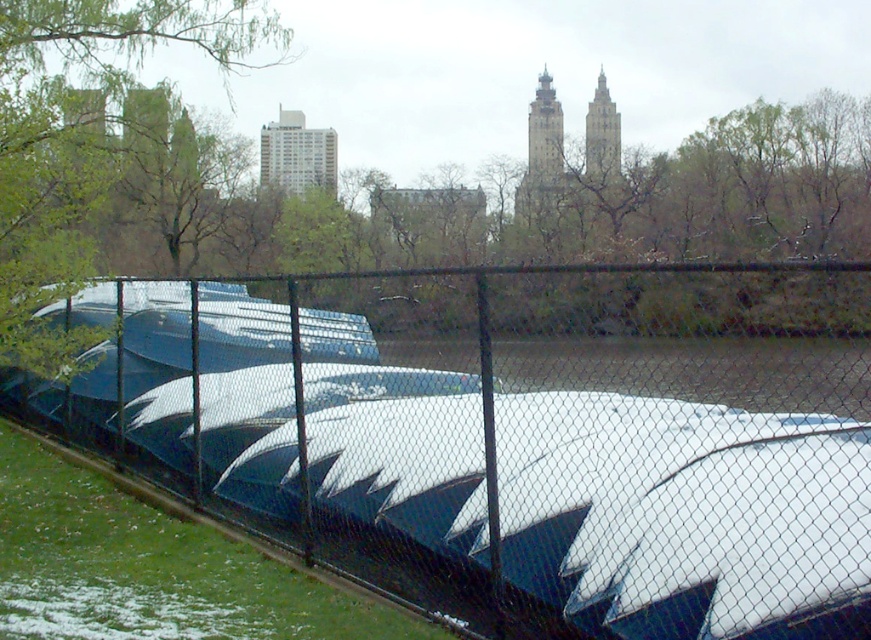
Which is behind, point (602, 468) or point (44, 93)?

Point (44, 93)

Who is more forward, (x=454, y=566) or (x=44, y=32)?

Positioned in front is point (x=454, y=566).

Which is behind, point (525, 621) or point (3, 35)?

The point (3, 35) is more distant.

The image size is (871, 640). Identify the location of black chain-link fence at center. (511, 436).